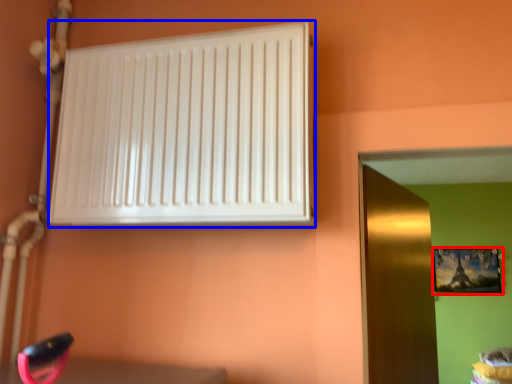
Question: Which object appears farthest to the camera in this image, picture frame (highlighted by a red box) or radiator (highlighted by a blue box)?

Choices:
 (A) picture frame
 (B) radiator

Answer: (A)